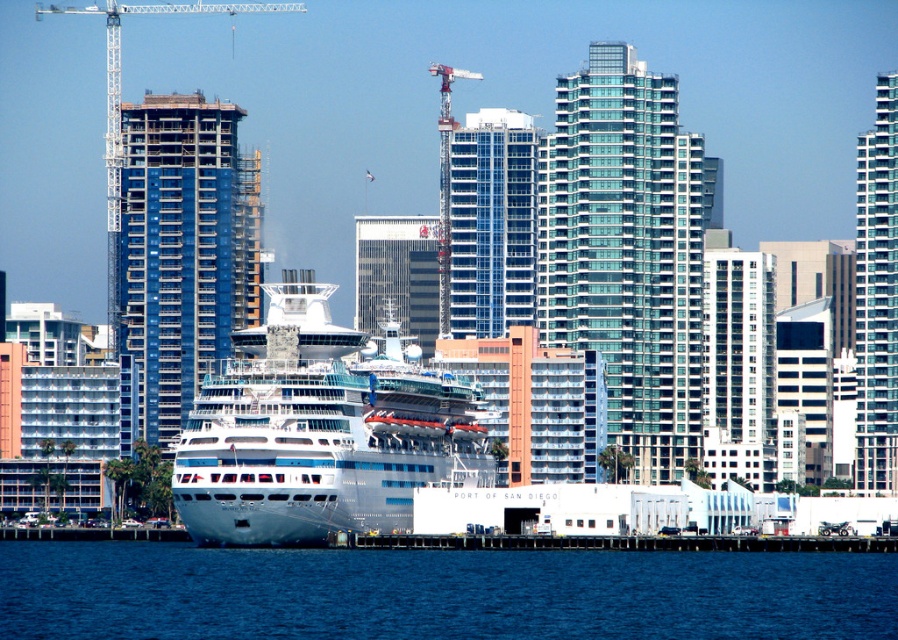
Based on the photo, is blue glass building at center wider than transparent glass skyscraper at right?

Correct, the width of blue glass building at center exceeds that of transparent glass skyscraper at right.

Is blue glass building at center bigger than transparent glass skyscraper at right?

Actually, blue glass building at center might be smaller than transparent glass skyscraper at right.

This screenshot has height=640, width=898. Identify the location of blue glass building at center. (492, 221).

Locate an element on the screen. blue glass building at center is located at coordinates (492, 221).

Is blue glass building at center positioned before white glass building at center-right?

No, it is behind white glass building at center-right.

Does blue glass building at center appear on the left side of white glass building at center-right?

Indeed, blue glass building at center is positioned on the left side of white glass building at center-right.

Image resolution: width=898 pixels, height=640 pixels. Describe the element at coordinates (492, 221) in the screenshot. I see `blue glass building at center` at that location.

At what (x,y) coordinates should I click in order to perform the action: click on blue glass building at center. Please return your answer as a coordinate pair (x, y). This screenshot has width=898, height=640. Looking at the image, I should click on (492, 221).

Can you confirm if glassy gray skyscraper at center is thinner than metallic silver crane at center?

No, glassy gray skyscraper at center is not thinner than metallic silver crane at center.

Which is above, glassy gray skyscraper at center or metallic silver crane at center?

Positioned higher is metallic silver crane at center.

The image size is (898, 640). In order to click on glassy gray skyscraper at center in this screenshot , I will do `click(397, 275)`.

Where is `glassy gray skyscraper at center`? glassy gray skyscraper at center is located at coordinates (397, 275).